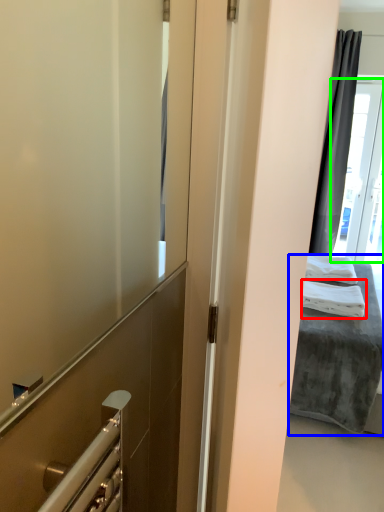
Question: Which object is positioned farthest from bath towel (highlighted by a red box)? Select from bed (highlighted by a blue box) and glass door (highlighted by a green box).

Choices:
 (A) bed
 (B) glass door

Answer: (B)